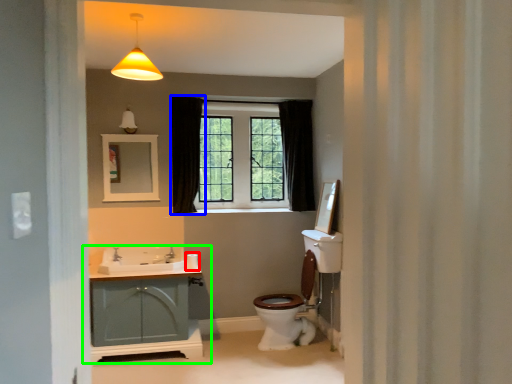
Question: Based on their relative distances, which object is nearer to toilet paper (highlighted by a red box)? Choose from curtain (highlighted by a blue box) and bathroom cabinet (highlighted by a green box).

Choices:
 (A) curtain
 (B) bathroom cabinet

Answer: (B)